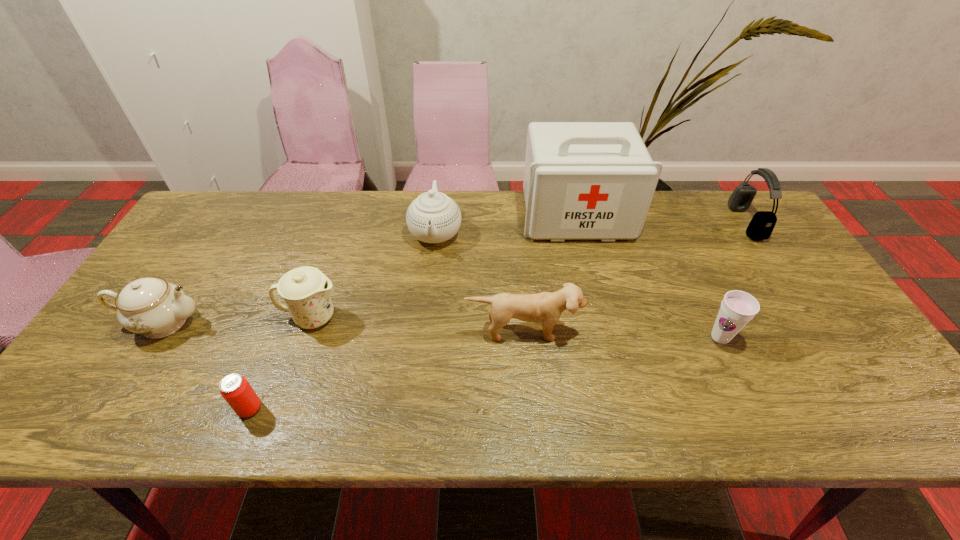
Image resolution: width=960 pixels, height=540 pixels. What are the coordinates of `vacant space located on the front-facing side of the tallest object` in the screenshot? It's located at (600, 313).

Identify the location of vacant space situated 0.080m on the headband of the headset. (711, 222).

I want to click on vacant space positioned 0.130m on the headband of the headset, so click(696, 222).

Identify the location of free region located 0.100m on the headband of the headset. The image size is (960, 540). (706, 222).

What are the coordinates of `vacant space located on the spout of the farthest chinaware` in the screenshot? It's located at (427, 305).

I want to click on vacant space located on the spout of the second chinaware from left to right, so click(x=409, y=318).

This screenshot has height=540, width=960. What are the coordinates of `free space located on the left side of the puppy` in the screenshot? It's located at pyautogui.click(x=527, y=373).

Image resolution: width=960 pixels, height=540 pixels. In order to click on free space located 0.120m at the spout of the leftmost object in this screenshot , I will do `click(252, 322)`.

The image size is (960, 540). Find the location of `vacant space situated on the left of the seventh object from left to right`. vacant space situated on the left of the seventh object from left to right is located at coordinates (596, 337).

Where is `vacant space situated on the left of the nearest object`? The image size is (960, 540). vacant space situated on the left of the nearest object is located at coordinates (201, 408).